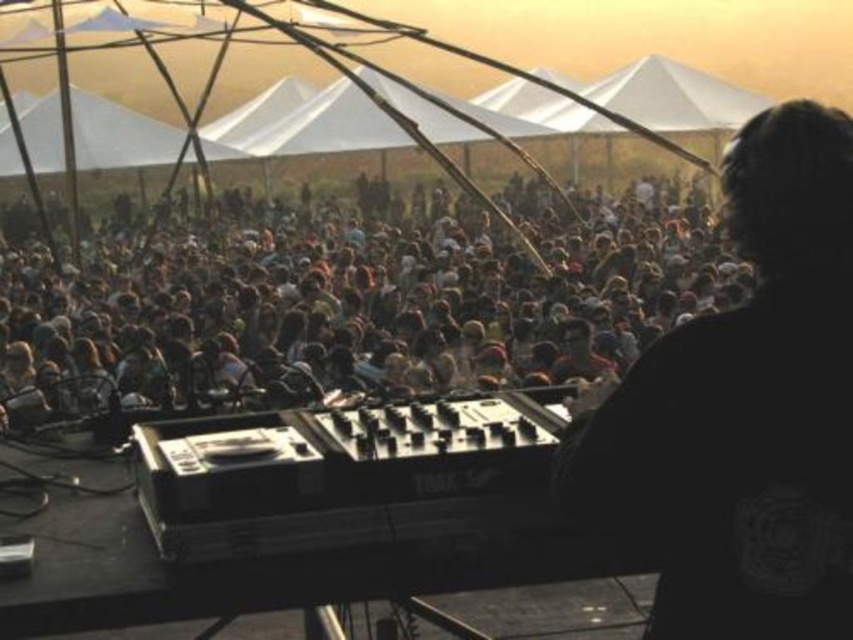
You are a photographer at the event and want to capture a clear shot of the DJ booth. However, you notice two elements blocking your view slightly. Which object is closer to you between the brown hair at center and the black matte headphones at right?

The brown hair at center is closer to you because the black matte headphones at right is behind it, meaning the brown hair at center is in front and obstructing the view more directly.